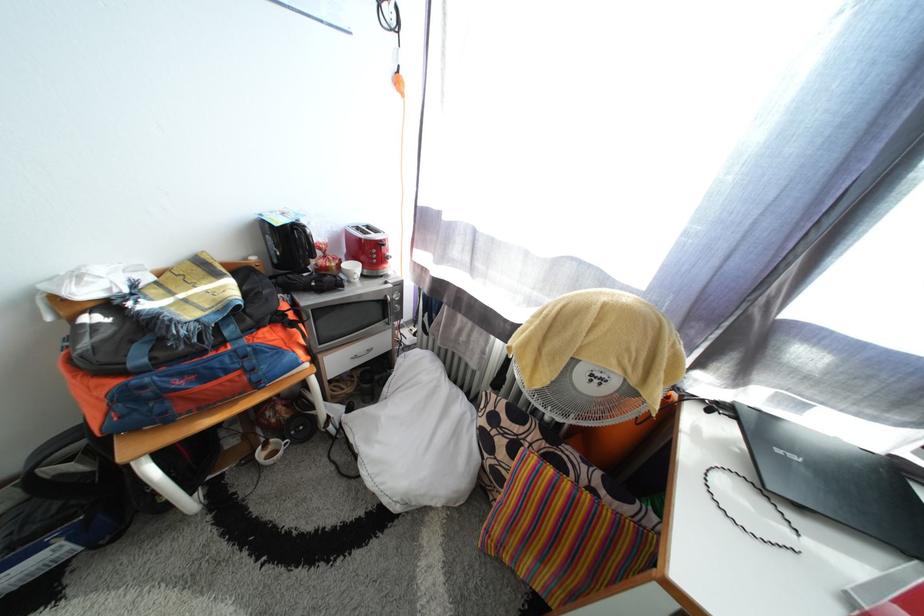
Locate an element on the screen. This screenshot has width=924, height=616. black kettle handle is located at coordinates (307, 240).